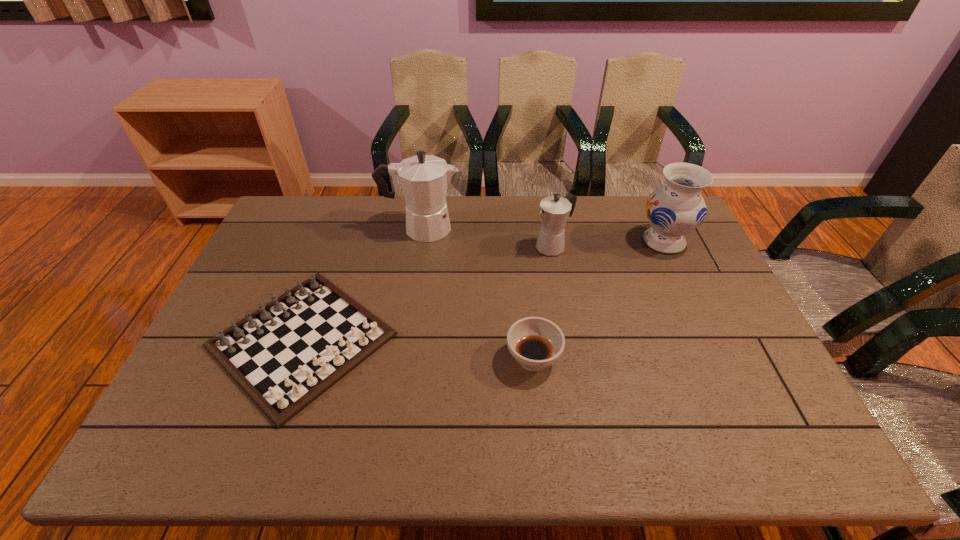
Locate an element on the screen. Image resolution: width=960 pixels, height=540 pixels. the left coffeepot is located at coordinates (424, 179).

Image resolution: width=960 pixels, height=540 pixels. I want to click on the rightmost object, so click(x=677, y=208).

The width and height of the screenshot is (960, 540). What are the coordinates of `the right coffeepot` in the screenshot? It's located at (554, 210).

The image size is (960, 540). What are the coordinates of `the shorter coffeepot` in the screenshot? It's located at (554, 210).

Locate an element on the screen. The height and width of the screenshot is (540, 960). soup bowl is located at coordinates (535, 343).

Find the location of a particular element. the shortest object is located at coordinates (285, 355).

At what (x,y) coordinates should I click in order to perform the action: click on vacant space positioned at the spout of the left coffeepot. Please return your answer as a coordinate pair (x, y). The width and height of the screenshot is (960, 540). Looking at the image, I should click on point(506,228).

Find the location of a particular element. The width and height of the screenshot is (960, 540). vacant space located on the left of the vase is located at coordinates (540, 241).

Where is `free space located 0.290m on the left of the shorter coffeepot`? This screenshot has height=540, width=960. free space located 0.290m on the left of the shorter coffeepot is located at coordinates (447, 246).

Find the location of a particular element. Image resolution: width=960 pixels, height=540 pixels. free spot located 0.260m on the back of the soup bowl is located at coordinates (524, 272).